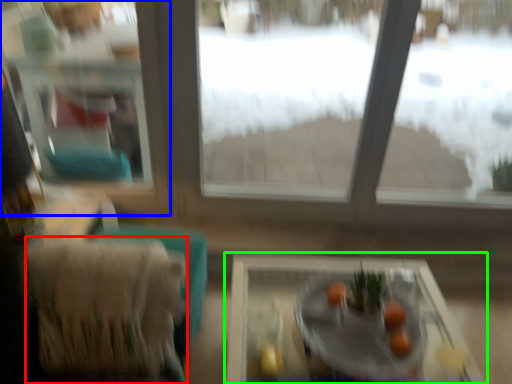
Question: Which is farther away from armchair (highlighted by a red box)? window frame (highlighted by a blue box) or table (highlighted by a green box)?

Choices:
 (A) window frame
 (B) table

Answer: (A)